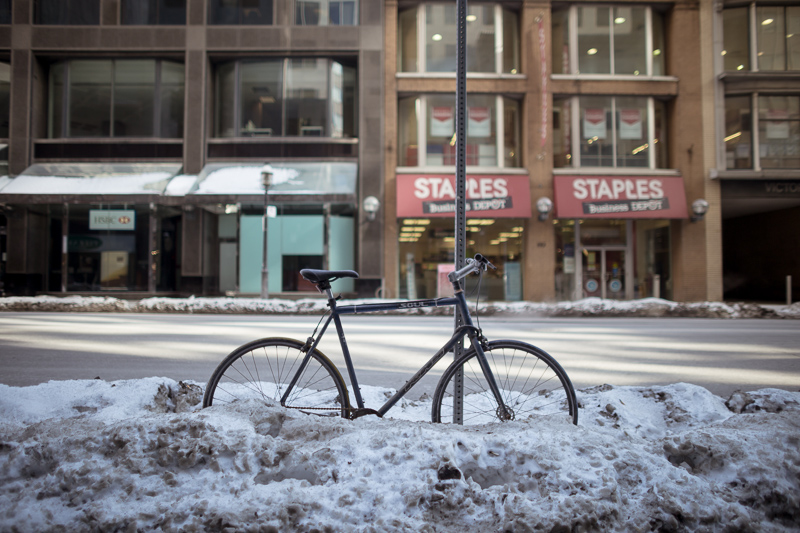
The width and height of the screenshot is (800, 533). In order to click on seat in this screenshot , I will do `click(317, 274)`.